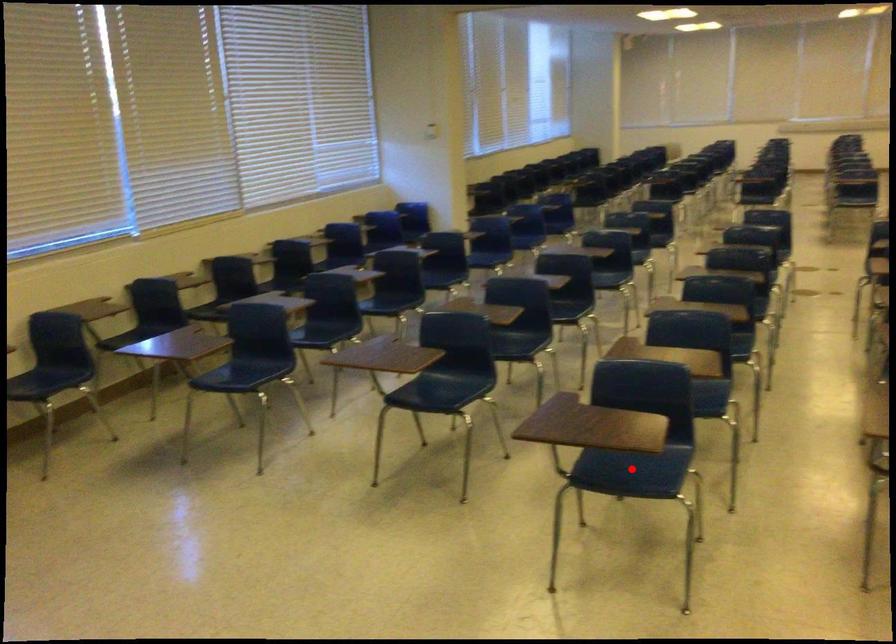
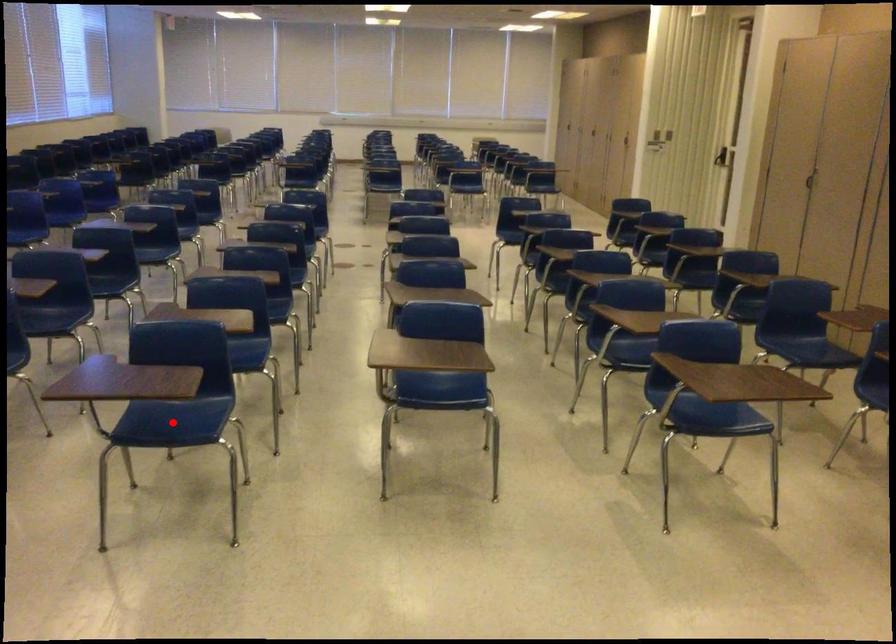
I am providing you with two images of the same scene from different viewpoints. A red point is marked on the first image and another point is marked on the second image. Does the point marked in image1 correspond to the same location as the one in image2?

Yes